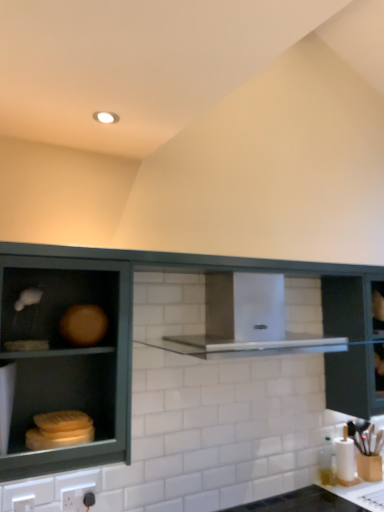
Question: Does black glossy countertop at lower right turn towards white plastic electric outlet at lower left, which is counted as the second electric outlet, starting from the right?

Choices:
 (A) no
 (B) yes

Answer: (A)

Question: Does black glossy countertop at lower right appear on the left side of white plastic electric outlet at lower left, the 2th electric outlet viewed from the back?

Choices:
 (A) yes
 (B) no

Answer: (B)

Question: Is black glossy countertop at lower right oriented away from white plastic electric outlet at lower left, the 1th electric outlet positioned from the front?

Choices:
 (A) no
 (B) yes

Answer: (A)

Question: Is black glossy countertop at lower right thinner than white plastic electric outlet at lower left, which is counted as the second electric outlet, starting from the right?

Choices:
 (A) yes
 (B) no

Answer: (B)

Question: Is black glossy countertop at lower right behind white plastic electric outlet at lower left, which is the 1th electric outlet in left-to-right order?

Choices:
 (A) no
 (B) yes

Answer: (A)

Question: From the image's perspective, is black glossy countertop at lower right over white plastic electric outlet at lower left, the 1th electric outlet positioned from the front?

Choices:
 (A) yes
 (B) no

Answer: (B)

Question: Is stainless steel vent at center oriented towards transparent glass cabinet at right?

Choices:
 (A) no
 (B) yes

Answer: (A)

Question: Considering the relative positions of stainless steel vent at center and transparent glass cabinet at right in the image provided, is stainless steel vent at center behind transparent glass cabinet at right?

Choices:
 (A) no
 (B) yes

Answer: (A)

Question: Is stainless steel vent at center far away from transparent glass cabinet at right?

Choices:
 (A) yes
 (B) no

Answer: (B)

Question: From a real-world perspective, is stainless steel vent at center on top of transparent glass cabinet at right?

Choices:
 (A) no
 (B) yes

Answer: (B)

Question: Is stainless steel vent at center bigger than transparent glass cabinet at right?

Choices:
 (A) yes
 (B) no

Answer: (B)

Question: Is stainless steel vent at center surrounding transparent glass cabinet at right?

Choices:
 (A) yes
 (B) no

Answer: (B)

Question: Considering the relative sizes of transparent glass cabinet at right and black plastic electric outlet at lower center, arranged as the 2th electric outlet when viewed from the left, in the image provided, is transparent glass cabinet at right wider than black plastic electric outlet at lower center, arranged as the 2th electric outlet when viewed from the left,?

Choices:
 (A) no
 (B) yes

Answer: (B)